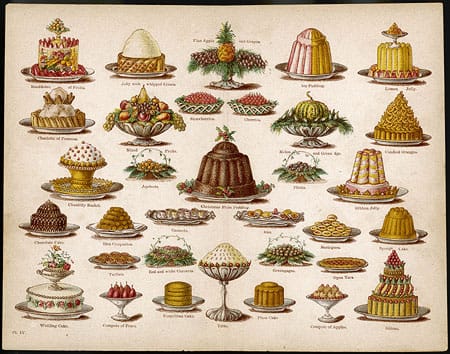
This screenshot has height=354, width=450. Find the location of `cake stand`. cake stand is located at coordinates (226, 272), (313, 130), (82, 176).